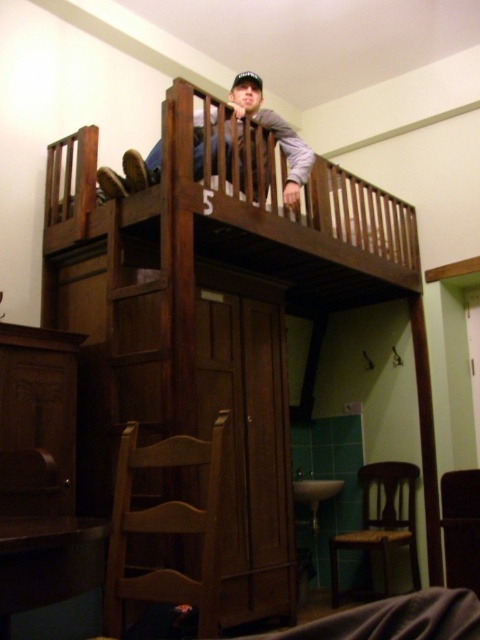
Question: Which point appears farthest from the camera in this image?

Choices:
 (A) [168, 397]
 (B) [290, 189]

Answer: (B)

Question: From the image, what is the correct spatial relationship of brown wooden bunk bed at upper center in relation to wooden bunk bed at upper center?

Choices:
 (A) left
 (B) right

Answer: (B)

Question: Among these points, which one is farthest from the camera?

Choices:
 (A) click(x=156, y=145)
 (B) click(x=208, y=333)

Answer: (A)

Question: Is brown wooden bunk bed at upper center below wooden bunk bed at upper center?

Choices:
 (A) yes
 (B) no

Answer: (A)

Question: Does brown wooden bunk bed at upper center appear on the right side of wooden bunk bed at upper center?

Choices:
 (A) yes
 (B) no

Answer: (A)